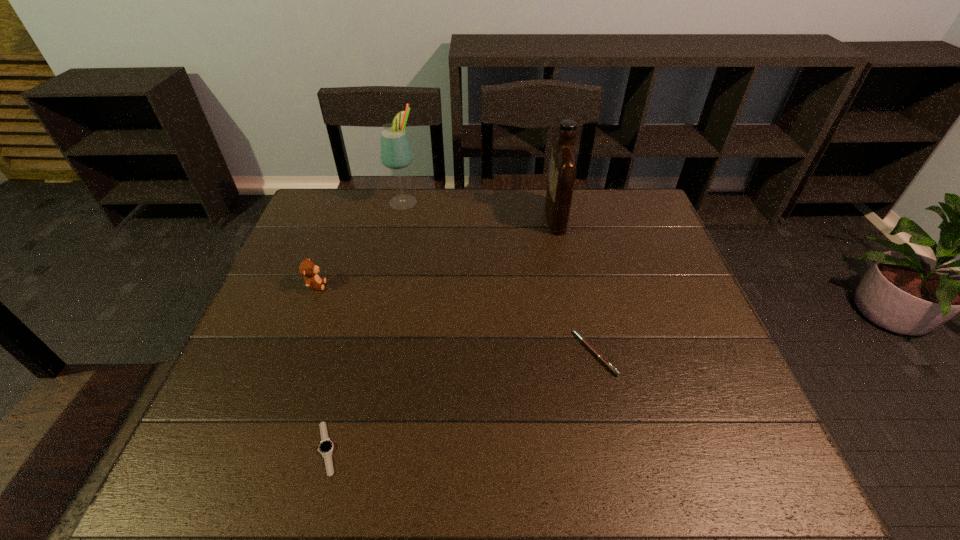
Image resolution: width=960 pixels, height=540 pixels. In order to click on object located at the left edge in this screenshot , I will do `click(308, 269)`.

Identify the location of free spot at the far edge of the desktop. This screenshot has height=540, width=960. (516, 210).

The width and height of the screenshot is (960, 540). Identify the location of free region at the near edge of the desktop. (462, 462).

Find the location of a particular element. vacant point at the left edge is located at coordinates (324, 247).

In the image, there is a desktop. Where is `vacant space at the right edge`? The height and width of the screenshot is (540, 960). vacant space at the right edge is located at coordinates (653, 296).

Image resolution: width=960 pixels, height=540 pixels. Find the location of `vacant space at the far right corner`. vacant space at the far right corner is located at coordinates (607, 197).

Image resolution: width=960 pixels, height=540 pixels. What are the coordinates of `free spot between the liquor and the nearest object` in the screenshot? It's located at (441, 333).

Locate an element on the screen. free area in between the third farthest object and the nearest object is located at coordinates (322, 367).

This screenshot has width=960, height=540. In order to click on free space between the second shortest object and the shortest object in this screenshot , I will do (461, 401).

Find the location of a particular element. The height and width of the screenshot is (540, 960). free space between the pen and the alcohol is located at coordinates (499, 277).